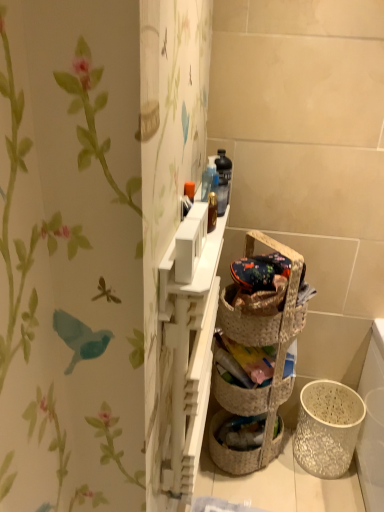
Question: Considering the positions of white matte cabinet at upper center and white textured basket at lower right, positioned as the 2th basket container in top-to-bottom order, in the image, is white matte cabinet at upper center bigger or smaller than white textured basket at lower right, positioned as the 2th basket container in top-to-bottom order,?

Choices:
 (A) big
 (B) small

Answer: (A)

Question: Considering the relative positions of white matte cabinet at upper center and white textured basket at lower right, which ranks as the first basket container in bottom-to-top order, in the image provided, is white matte cabinet at upper center to the left or to the right of white textured basket at lower right, which ranks as the first basket container in bottom-to-top order,?

Choices:
 (A) right
 (B) left

Answer: (B)

Question: Which is farther from the woven straw basket at center, which is counted as the 2th basket container, starting from the right?

Choices:
 (A) white textured basket at lower right, the 1th basket container from the right
 (B) white matte cabinet at upper center
 (C) woven brown picnic basket at center

Answer: (B)

Question: Which is nearer to the woven brown picnic basket at center?

Choices:
 (A) woven straw basket at center, which is counted as the 2th basket container, starting from the right
 (B) white textured basket at lower right, the 1th basket container from the right
 (C) white matte cabinet at upper center

Answer: (A)